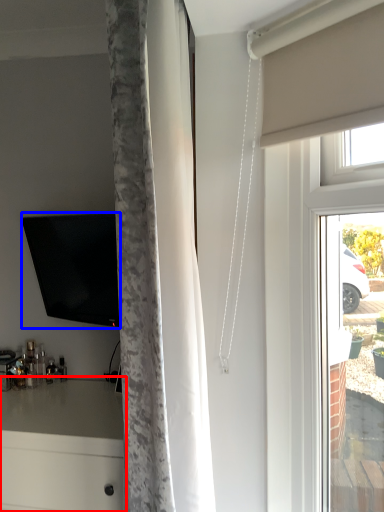
Question: Which object appears closest to the camera in this image, counter (highlighted by a red box) or television (highlighted by a blue box)?

Choices:
 (A) counter
 (B) television

Answer: (A)